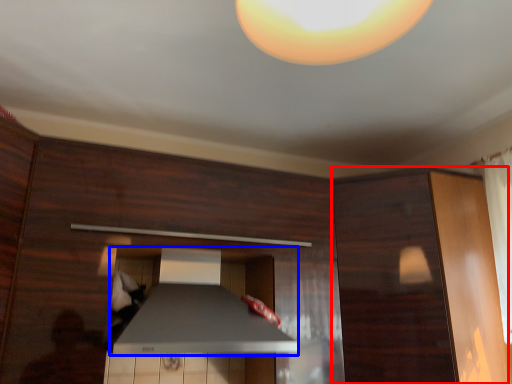
Question: Which of the following is the closest to the observer, cabinetry (highlighted by a red box) or exhaust hood (highlighted by a blue box)?

Choices:
 (A) cabinetry
 (B) exhaust hood

Answer: (B)